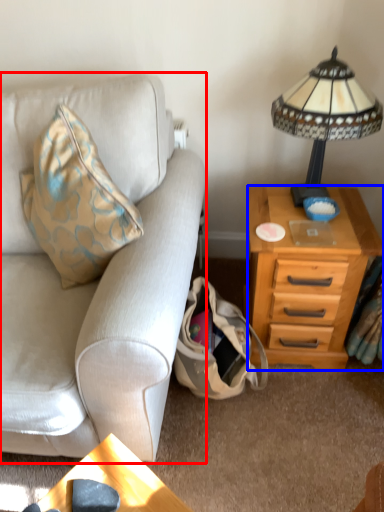
Question: Which point is further to the camera, studio couch (highlighted by a red box) or nightstand (highlighted by a blue box)?

Choices:
 (A) studio couch
 (B) nightstand

Answer: (B)